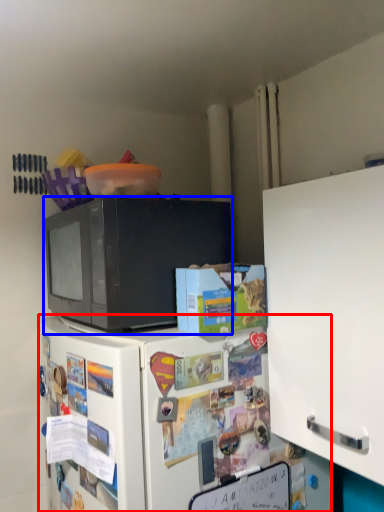
Question: Which of the following is the farthest to the observer, refrigerator (highlighted by a red box) or microwave oven (highlighted by a blue box)?

Choices:
 (A) refrigerator
 (B) microwave oven

Answer: (B)